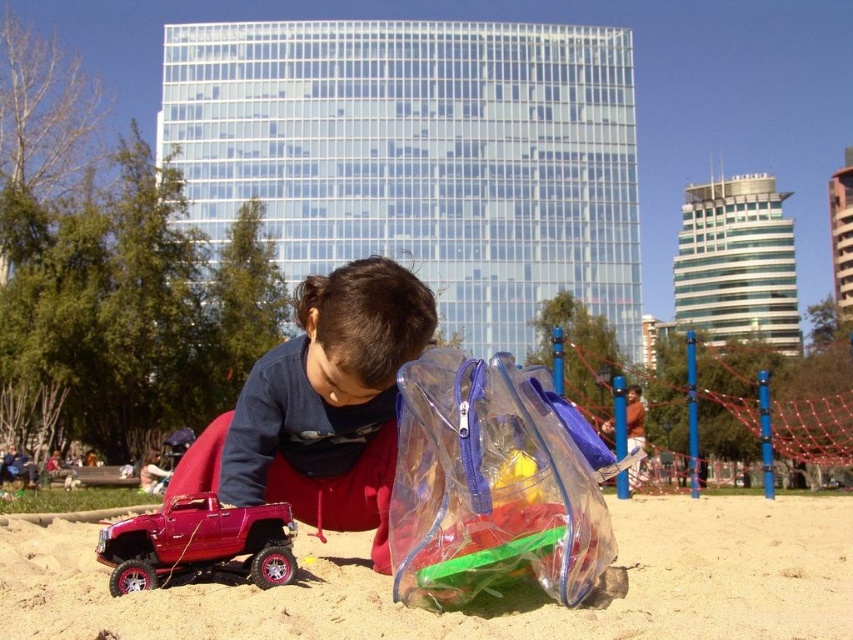
Question: Which point is farther to the camera?

Choices:
 (A) (384, 529)
 (B) (573, 444)

Answer: (A)

Question: Estimate the real-world distances between objects in this image. Which object is closer to the dark blue fabric at center?

Choices:
 (A) transparent plastic bag at center
 (B) fine-grained sand at lower center
 (C) shiny red plastic toy car at lower left

Answer: (C)

Question: Can you confirm if transparent plastic bag at center is bigger than dark blue fabric at center?

Choices:
 (A) no
 (B) yes

Answer: (A)

Question: Which point appears closest to the camera in this image?

Choices:
 (A) (357, 579)
 (B) (117, 529)

Answer: (B)

Question: Does fine-grained sand at lower center appear on the left side of shiny red plastic toy car at lower left?

Choices:
 (A) yes
 (B) no

Answer: (B)

Question: Is fine-grained sand at lower center behind dark blue fabric at center?

Choices:
 (A) yes
 (B) no

Answer: (B)